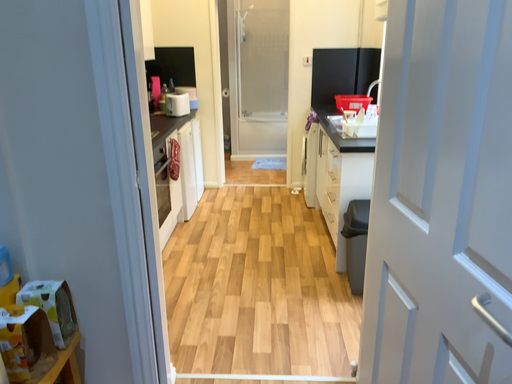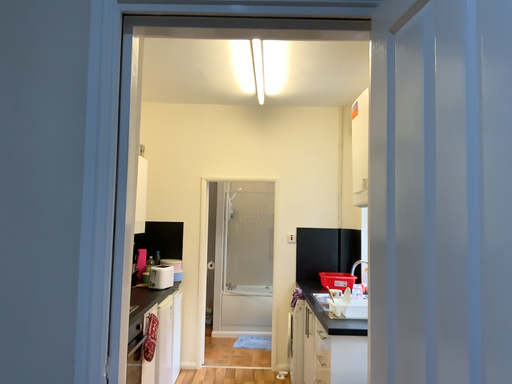
Question: How did the camera likely rotate when shooting the video?

Choices:
 (A) rotated downward
 (B) rotated upward

Answer: (B)